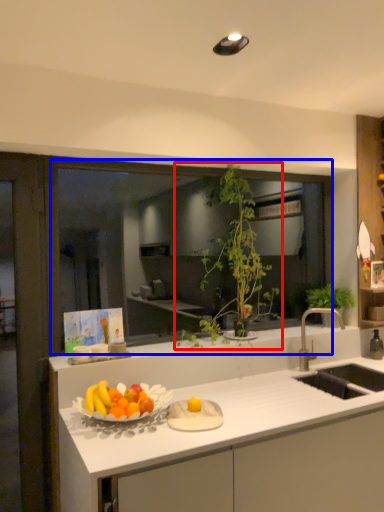
Question: Which point is further to the camera, houseplant (highlighted by a red box) or window (highlighted by a blue box)?

Choices:
 (A) houseplant
 (B) window

Answer: (B)